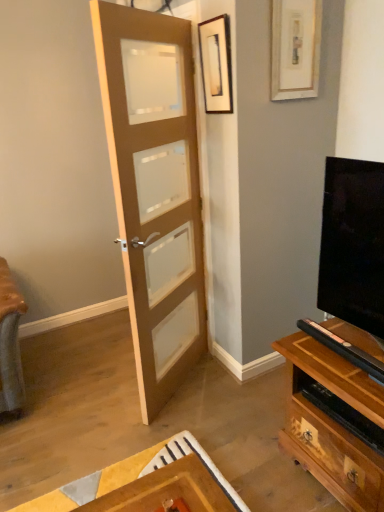
Question: From the image's perspective, is wooden framed picture at upper center, acting as the second picture frame starting from the right, located beneath matte wood door at center?

Choices:
 (A) yes
 (B) no

Answer: (B)

Question: Is wooden framed picture at upper center, the first picture frame when ordered from left to right, completely or partially outside of matte wood door at center?

Choices:
 (A) yes
 (B) no

Answer: (A)

Question: Is wooden framed picture at upper center, acting as the second picture frame starting from the right, facing towards matte wood door at center?

Choices:
 (A) no
 (B) yes

Answer: (B)

Question: Does wooden framed picture at upper center, the first picture frame when ordered from left to right, have a larger size compared to matte wood door at center?

Choices:
 (A) no
 (B) yes

Answer: (A)

Question: Considering the relative sizes of wooden framed picture at upper center, acting as the second picture frame starting from the right, and matte wood door at center in the image provided, is wooden framed picture at upper center, acting as the second picture frame starting from the right, smaller than matte wood door at center?

Choices:
 (A) yes
 (B) no

Answer: (A)

Question: Is wooden framed picture at upper center, the first picture frame when ordered from left to right, wider or thinner than white matte picture frame at upper right, the 2th picture frame positioned from the left?

Choices:
 (A) wide
 (B) thin

Answer: (A)

Question: Would you say wooden framed picture at upper center, acting as the second picture frame starting from the right, is to the left or to the right of white matte picture frame at upper right, the 2th picture frame positioned from the left, in the picture?

Choices:
 (A) right
 (B) left

Answer: (B)

Question: Considering the positions of wooden framed picture at upper center, the first picture frame when ordered from left to right, and white matte picture frame at upper right, the 2th picture frame positioned from the left, in the image, is wooden framed picture at upper center, the first picture frame when ordered from left to right, bigger or smaller than white matte picture frame at upper right, the 2th picture frame positioned from the left,?

Choices:
 (A) big
 (B) small

Answer: (B)

Question: From a real-world perspective, relative to white matte picture frame at upper right, which is the 1th picture frame in right-to-left order, is wooden framed picture at upper center, acting as the second picture frame starting from the right, vertically above or below?

Choices:
 (A) above
 (B) below

Answer: (B)

Question: Is point (122, 55) positioned closer to the camera than point (309, 2)?

Choices:
 (A) closer
 (B) farther

Answer: (A)

Question: Relative to white matte picture frame at upper right, which is the 1th picture frame in right-to-left order, is matte wood door at center in front or behind?

Choices:
 (A) behind
 (B) front

Answer: (B)

Question: In the image, is matte wood door at center on the left side or the right side of white matte picture frame at upper right, the 2th picture frame positioned from the left?

Choices:
 (A) left
 (B) right

Answer: (A)

Question: Is matte wood door at center wider or thinner than white matte picture frame at upper right, which is the 1th picture frame in right-to-left order?

Choices:
 (A) thin
 (B) wide

Answer: (B)

Question: Does point (218, 56) appear closer or farther from the camera than point (137, 172)?

Choices:
 (A) closer
 (B) farther

Answer: (B)

Question: From their relative heights in the image, would you say wooden framed picture at upper center, the first picture frame when ordered from left to right, is taller or shorter than matte wood door at center?

Choices:
 (A) short
 (B) tall

Answer: (A)